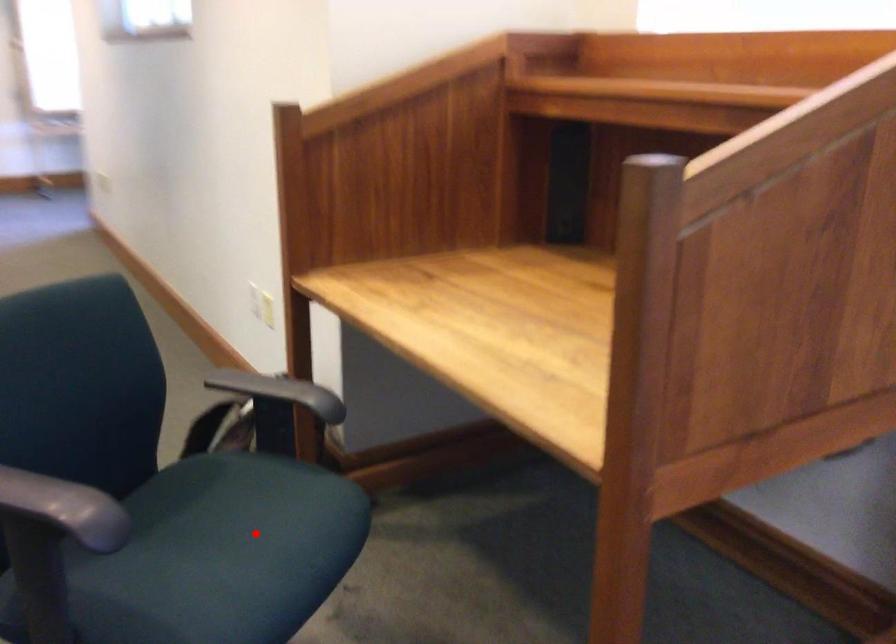
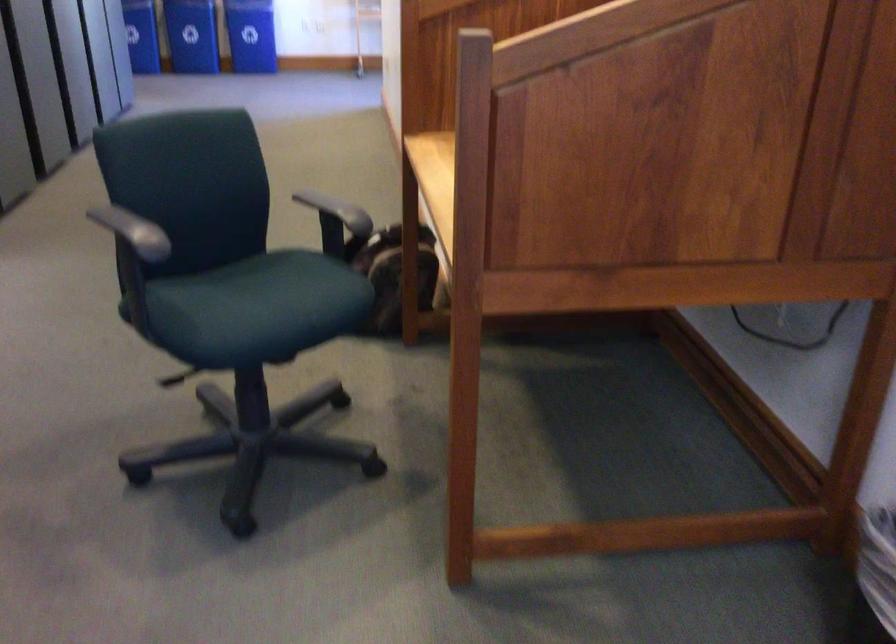
In the second image, find the point that corresponds to the highlighted location in the first image.

(277, 295)